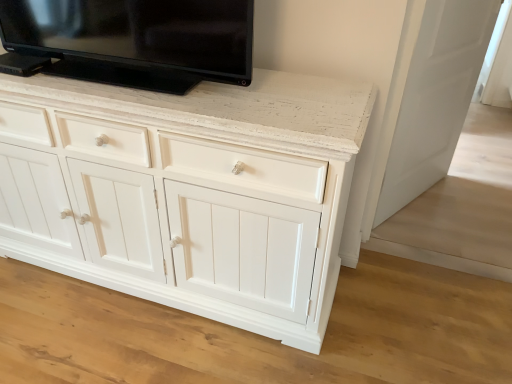
Find the location of `free point below white glossy door at right (from a real-world perspective)`. free point below white glossy door at right (from a real-world perspective) is located at coordinates (420, 202).